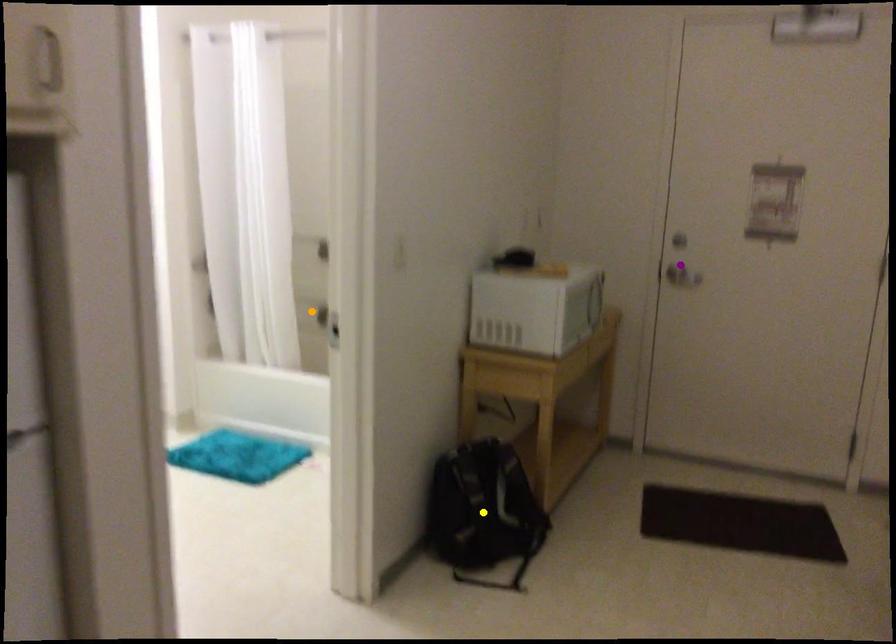
Order these from nearest to farthest:
1. yellow point
2. purple point
3. orange point

orange point < purple point < yellow point